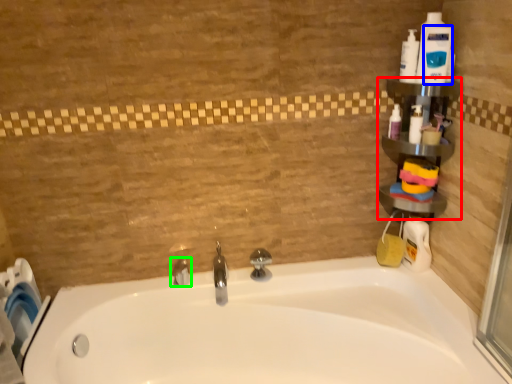
Question: Based on their relative distances, which object is nearer to shelf (highlighted by a red box)? Choose from cleaning product (highlighted by a blue box) and tap (highlighted by a green box).

Choices:
 (A) cleaning product
 (B) tap

Answer: (A)